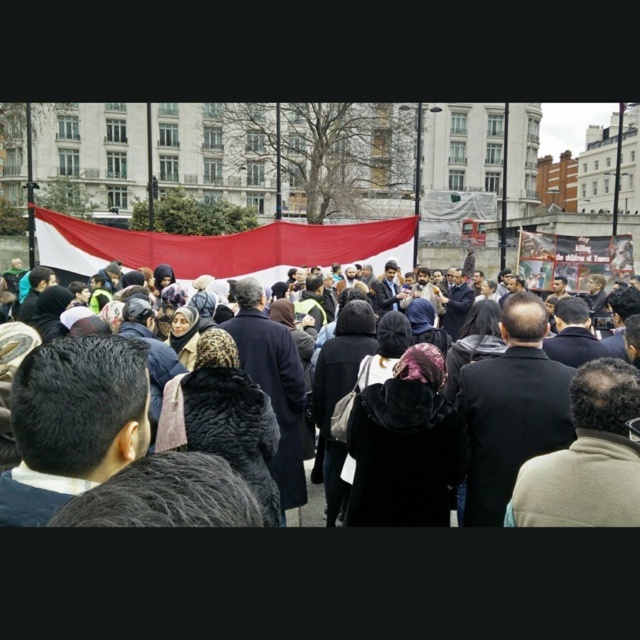
You are standing in the crowd at the public event. You notice two points marked in the scene. The first point is at coordinates point [376,262], and the second is at point [109,316]. Which point is closer to you?

Point [376,262] is further to the viewer than point [109,316]. Therefore, point [109,316] is closer to you.

You are a photographer standing at the event, and you want to capture the red fabric banner at center in your shot. Given that the banner is 95.76 meters away from the camera, can you estimate whether your standard 50mm lens will be able to frame the banner clearly without needing to zoom in excessively?

The red fabric banner at center is 95.76 meters away from the camera. A standard 50mm lens has a moderate field of view, but at this distance, the banner may appear small in the frame. To capture it clearly without excessive zoom, you might need a telephoto lens with a longer focal length for better reach.

You are a photographer at the event and want to capture a clear photo of the dark gray coat at center without the red fabric banner at center blocking it. How should you adjust your camera angle?

The red fabric banner at center is positioned over the dark gray coat at center, so you should lower your camera angle to capture the dark gray coat at center without the banner blocking it.